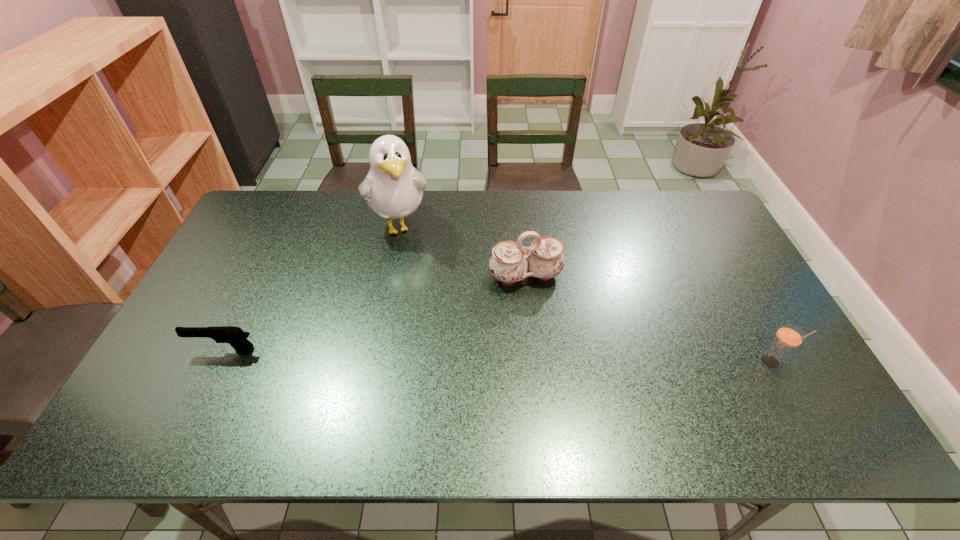
I want to click on free space that is in between the rightmost object and the farthest object, so click(586, 294).

Image resolution: width=960 pixels, height=540 pixels. I want to click on free point between the rightmost object and the tallest object, so click(586, 294).

Where is `free area in between the straw and the pistol`? This screenshot has height=540, width=960. free area in between the straw and the pistol is located at coordinates (497, 356).

Where is `unoccupied area between the gull and the straw`? The height and width of the screenshot is (540, 960). unoccupied area between the gull and the straw is located at coordinates (586, 294).

You are a GUI agent. You are given a task and a screenshot of the screen. Output one action in this format:
    pyautogui.click(x=<x>, y=<y>)
    Task: Click on the object that can be found as the second closest to the third object from left to right
    
    Given the screenshot: What is the action you would take?
    pyautogui.click(x=789, y=336)

Identify which object is located as the nearest to the leftmost object. Please provide its 2D coordinates. Your answer should be formatted as a tuple, i.e. [(x, y)], where the tuple contains the x and y coordinates of a point satisfying the conditions above.

[(393, 188)]

Identify the location of vacant space that satisfies the following two spatial constraints: 1. on the front side of the farthest object; 2. on the left side of the second farthest object. Image resolution: width=960 pixels, height=540 pixels. (390, 276).